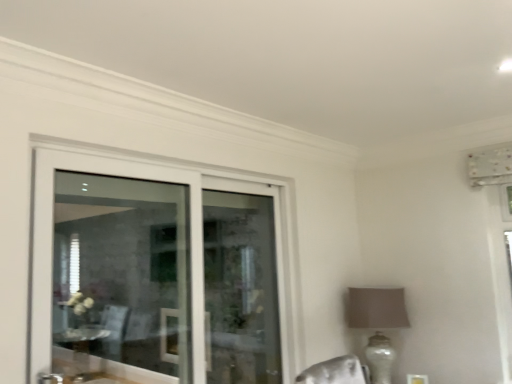
Question: In terms of height, does matte beige lampshade at right look taller or shorter compared to clear glass door at upper left?

Choices:
 (A) short
 (B) tall

Answer: (A)

Question: Visually, is matte beige lampshade at right positioned to the left or to the right of clear glass door at upper left?

Choices:
 (A) left
 (B) right

Answer: (B)

Question: Is point (393, 352) positioned closer to the camera than point (92, 177)?

Choices:
 (A) farther
 (B) closer

Answer: (A)

Question: Is clear glass door at upper left spatially inside matte beige lampshade at right, or outside of it?

Choices:
 (A) inside
 (B) outside

Answer: (B)

Question: Is point (141, 324) closer or farther from the camera than point (380, 292)?

Choices:
 (A) farther
 (B) closer

Answer: (A)

Question: From a real-world perspective, is clear glass door at upper left above or below matte beige lampshade at right?

Choices:
 (A) below
 (B) above

Answer: (B)

Question: Considering the positions of clear glass door at upper left and matte beige lampshade at right in the image, is clear glass door at upper left taller or shorter than matte beige lampshade at right?

Choices:
 (A) tall
 (B) short

Answer: (A)